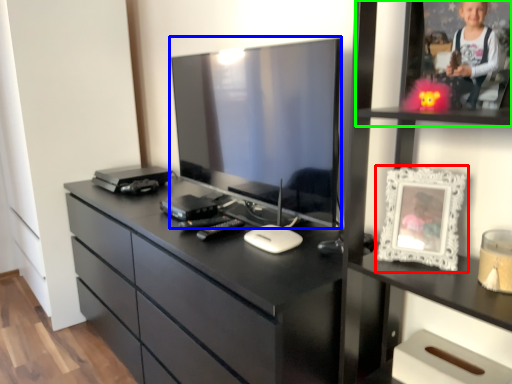
Question: Estimate the real-world distances between objects in this image. Which object is farther from picture frame (highlighted by a red box), television (highlighted by a blue box) or shelf (highlighted by a green box)?

Choices:
 (A) television
 (B) shelf

Answer: (A)